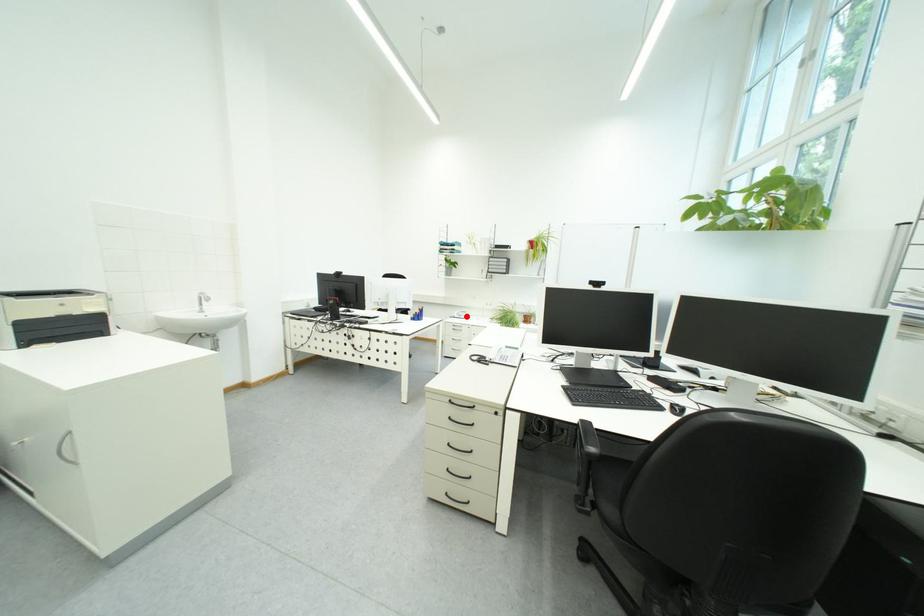
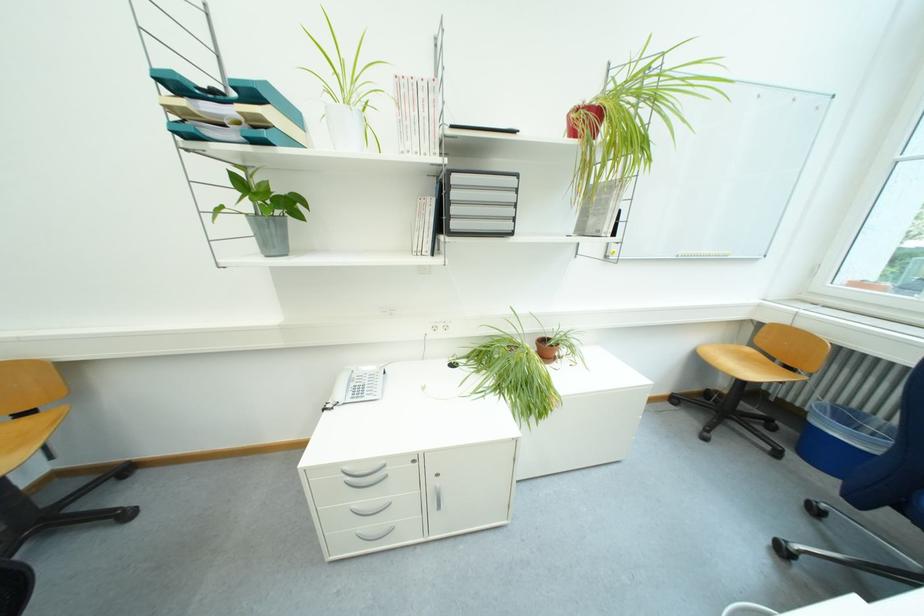
Question: I am providing you with two images of the same scene from different viewpoints. A red point is marked on the first image. Is the red point's position out of view in image 2?

Choices:
 (A) Yes
 (B) No

Answer: (B)